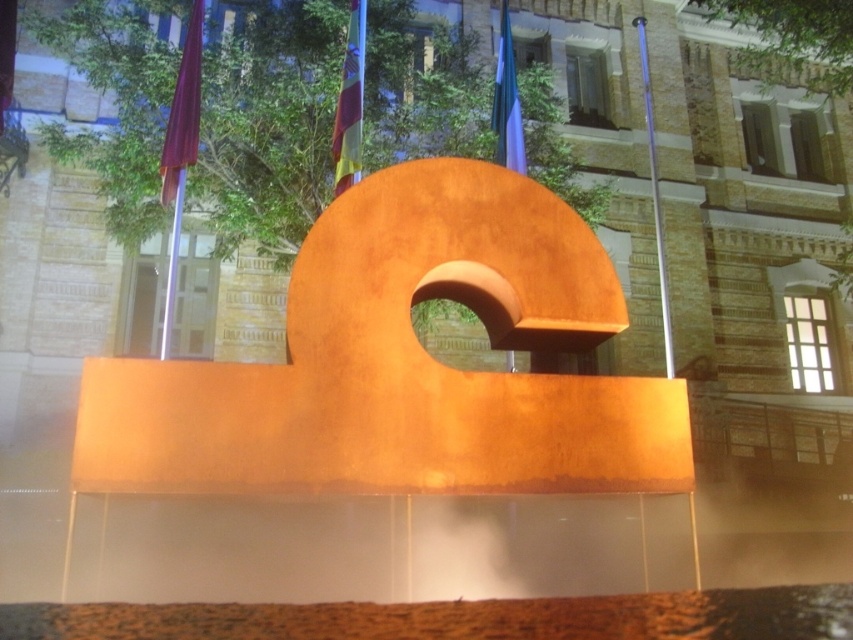
Can you confirm if rustic wood sculpture at center is smaller than matte red flag at upper left?

No.

Find the location of `rustic wood sculpture at center`. rustic wood sculpture at center is located at coordinates (403, 364).

This screenshot has height=640, width=853. What do you see at coordinates (350, 104) in the screenshot? I see `silky fabric flag at upper center` at bounding box center [350, 104].

Does silky fabric flag at upper center have a lesser width compared to silky blue flag at upper center?

Indeed, silky fabric flag at upper center has a lesser width compared to silky blue flag at upper center.

The image size is (853, 640). I want to click on silky fabric flag at upper center, so click(x=350, y=104).

Find the location of a particular element. The image size is (853, 640). silky fabric flag at upper center is located at coordinates (350, 104).

Identify the location of rustic wood sculpture at center. (403, 364).

Between point (538, 348) and point (509, 163), which one is positioned behind?

Point (509, 163)

Where is `rustic wood sculpture at center`? Image resolution: width=853 pixels, height=640 pixels. rustic wood sculpture at center is located at coordinates (403, 364).